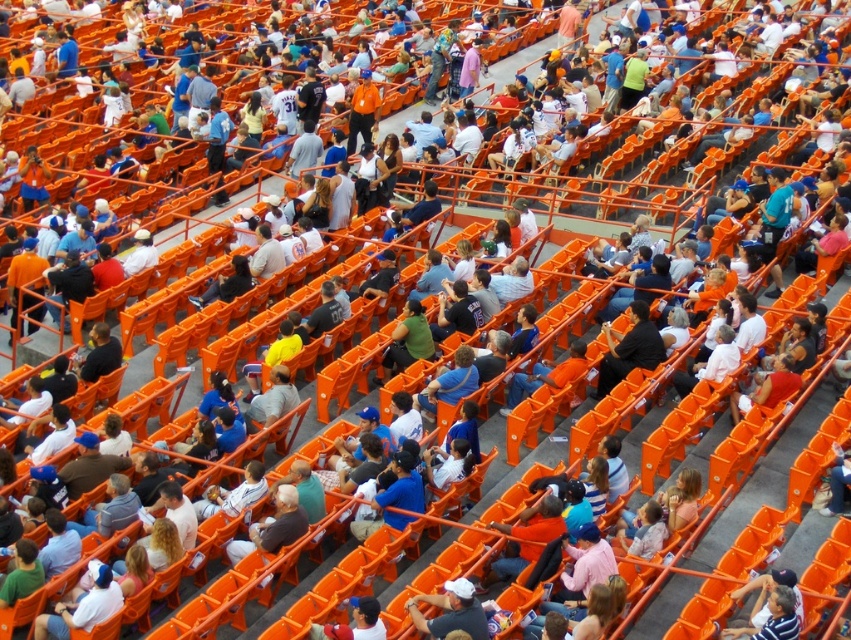
Question: Is black shirt at center positioned in front of white matte baseball cap at center?

Choices:
 (A) no
 (B) yes

Answer: (A)

Question: Where is black shirt at center located in relation to white matte baseball cap at center in the image?

Choices:
 (A) below
 (B) above

Answer: (B)

Question: Does black shirt at center have a larger size compared to white matte baseball cap at center?

Choices:
 (A) no
 (B) yes

Answer: (B)

Question: Which object appears farthest from the camera in this image?

Choices:
 (A) black shirt at center
 (B) white matte baseball cap at center

Answer: (A)